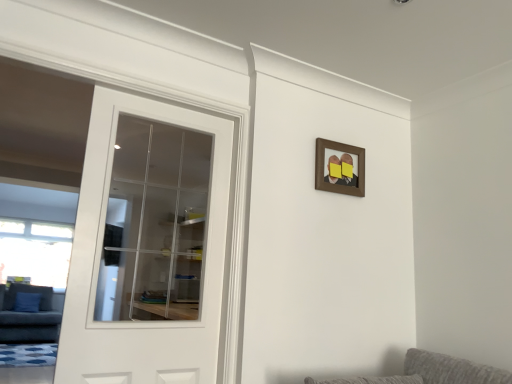
Question: Is white glass door at left thinner than dark gray fabric couch at left?

Choices:
 (A) yes
 (B) no

Answer: (A)

Question: Is white glass door at left turned away from dark gray fabric couch at left?

Choices:
 (A) yes
 (B) no

Answer: (A)

Question: Considering the relative sizes of white glass door at left and dark gray fabric couch at left in the image provided, is white glass door at left bigger than dark gray fabric couch at left?

Choices:
 (A) yes
 (B) no

Answer: (B)

Question: From a real-world perspective, is white glass door at left positioned over dark gray fabric couch at left based on gravity?

Choices:
 (A) yes
 (B) no

Answer: (A)

Question: Is white glass door at left outside of dark gray fabric couch at left?

Choices:
 (A) no
 (B) yes

Answer: (B)

Question: Is white glass door at left surrounding dark gray fabric couch at left?

Choices:
 (A) no
 (B) yes

Answer: (A)

Question: Is brown wooden picture frame at upper center to the left of dark gray fabric couch at left from the viewer's perspective?

Choices:
 (A) no
 (B) yes

Answer: (A)

Question: Is brown wooden picture frame at upper center turned away from dark gray fabric couch at left?

Choices:
 (A) no
 (B) yes

Answer: (B)

Question: From the image's perspective, is brown wooden picture frame at upper center located beneath dark gray fabric couch at left?

Choices:
 (A) yes
 (B) no

Answer: (B)

Question: Considering the relative sizes of brown wooden picture frame at upper center and dark gray fabric couch at left in the image provided, is brown wooden picture frame at upper center bigger than dark gray fabric couch at left?

Choices:
 (A) yes
 (B) no

Answer: (B)

Question: Is brown wooden picture frame at upper center next to dark gray fabric couch at left and touching it?

Choices:
 (A) no
 (B) yes

Answer: (A)

Question: From the image's perspective, would you say brown wooden picture frame at upper center is positioned over dark gray fabric couch at left?

Choices:
 (A) no
 (B) yes

Answer: (B)

Question: From the image's perspective, is dark gray fabric couch at left located above white glass door at left?

Choices:
 (A) yes
 (B) no

Answer: (B)